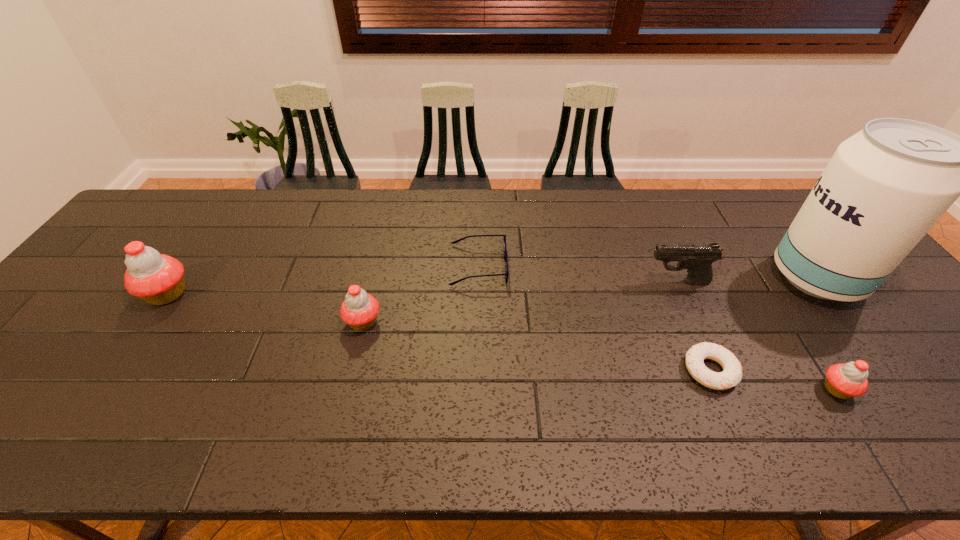
The width and height of the screenshot is (960, 540). In order to click on cupcake that is at the near edge in this screenshot , I will do `click(844, 381)`.

The image size is (960, 540). I want to click on doughnut located at the near edge, so click(731, 375).

The width and height of the screenshot is (960, 540). What are the coordinates of `object positioned at the right edge` in the screenshot? It's located at (884, 188).

The width and height of the screenshot is (960, 540). I want to click on free location at the far edge, so click(681, 200).

In the image, there is a desktop. Identify the location of vacant space at the near edge. (113, 381).

Locate an element on the screen. This screenshot has width=960, height=540. free space at the left edge of the desktop is located at coordinates (163, 237).

I want to click on empty space between the second shortest cupcake and the fifth object from right to left, so click(x=420, y=294).

Find the location of a particular element. The height and width of the screenshot is (540, 960). vacant area that lies between the alcohol and the shortest object is located at coordinates (763, 324).

Find the location of a particular element. vacant region between the pistol and the spectacles is located at coordinates (578, 274).

Locate an element on the screen. This screenshot has width=960, height=540. empty space that is in between the pistol and the second cupcake from left to right is located at coordinates (520, 302).